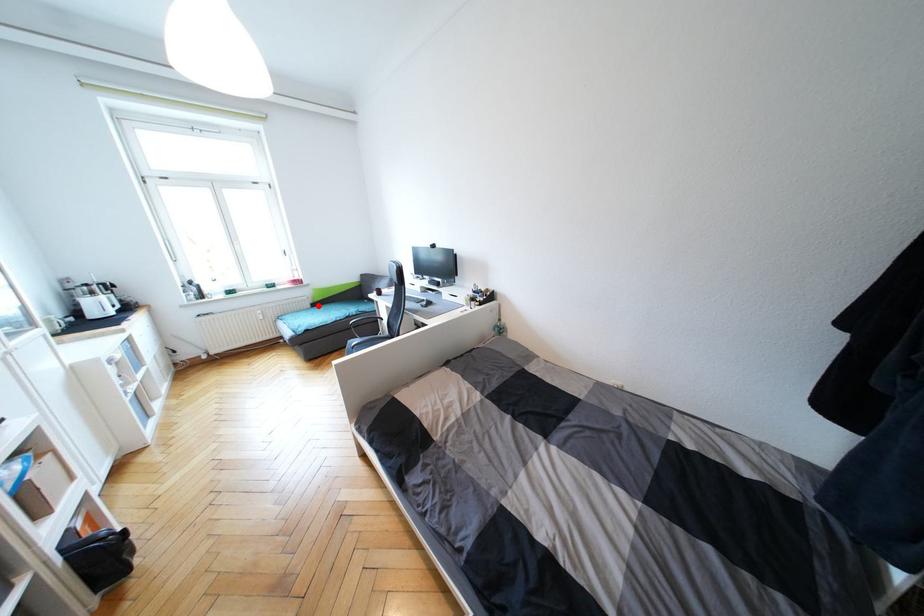
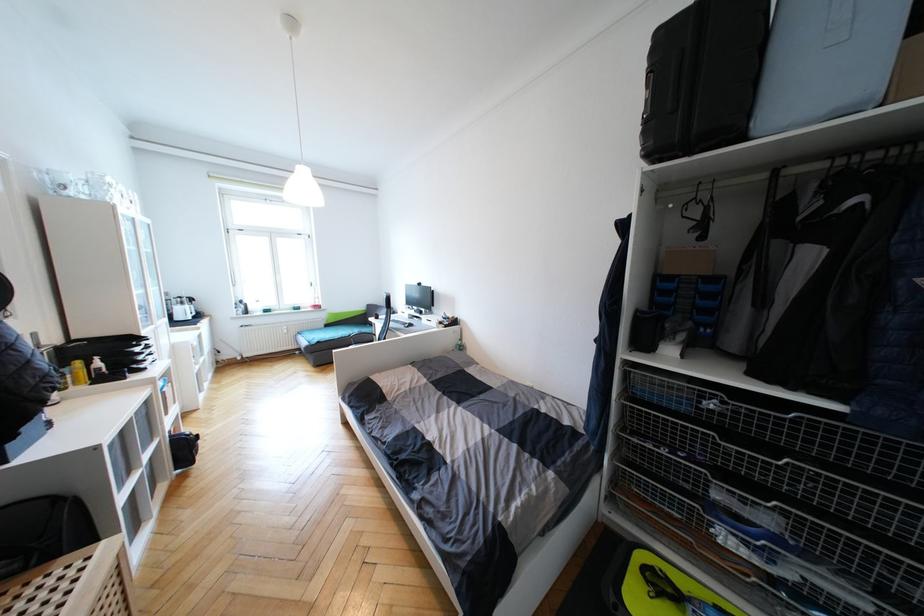
Question: I am providing you with two images of the same scene from different viewpoints. Image1 has a red point marked. In image2, the corresponding 3D location appears at what relative position? Reply with the corresponding letter.

Choices:
 (A) Closer
 (B) Farther

Answer: (B)